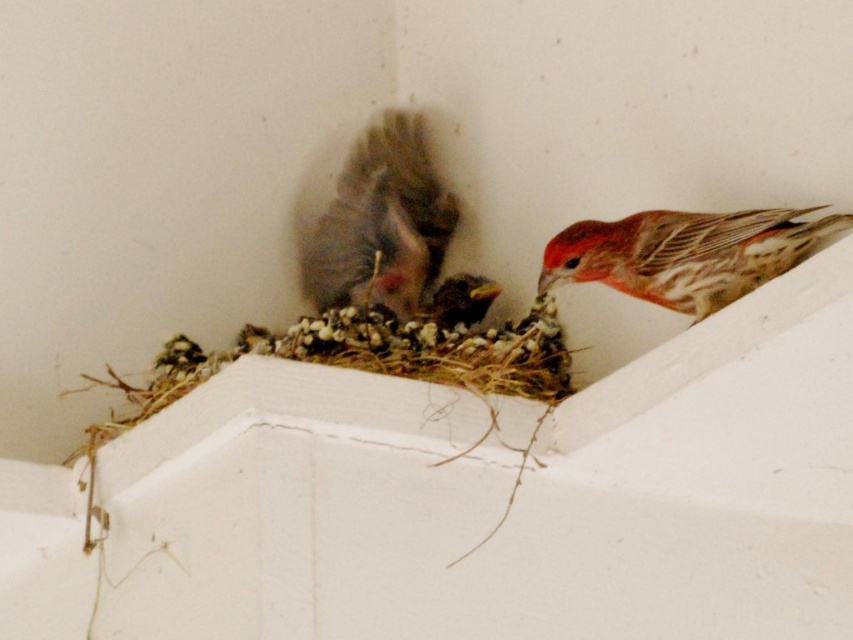
Is gray fluffy sparrow at center to the left of reddish-brown speckled feathers at upper right from the viewer's perspective?

Indeed, gray fluffy sparrow at center is positioned on the left side of reddish-brown speckled feathers at upper right.

Locate an element on the screen. gray fluffy sparrow at center is located at coordinates (381, 221).

The image size is (853, 640). What do you see at coordinates (381, 221) in the screenshot?
I see `gray fluffy sparrow at center` at bounding box center [381, 221].

This screenshot has height=640, width=853. What are the coordinates of `gray fluffy sparrow at center` in the screenshot? It's located at (381, 221).